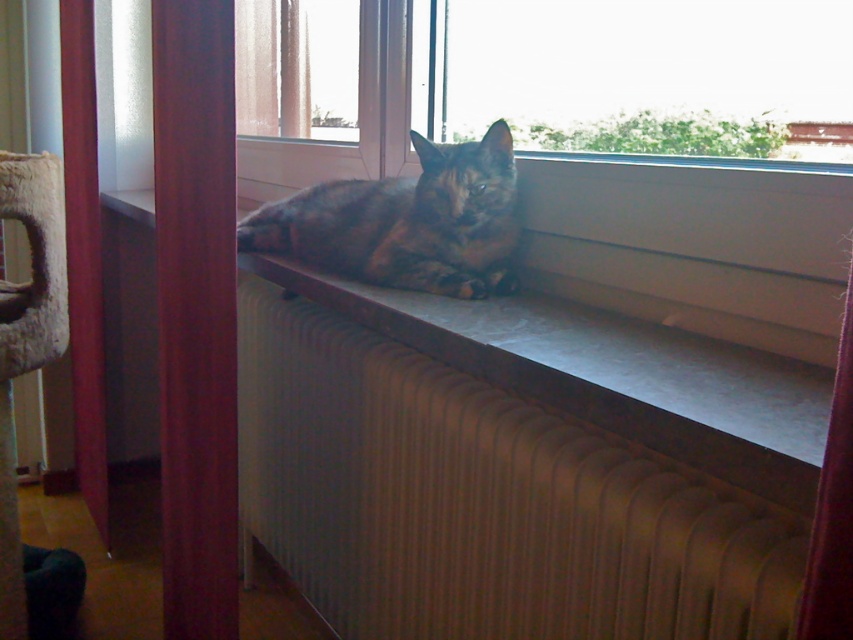
You are a cat owner who wants to place a small cat tree between the metallic radiator at lower center and the velvet red curtain at lower right. The cat tree requires 30 inches of space. Based on the scene, will there be enough space?

The metallic radiator at lower center and velvet red curtain at lower right are 27.92 inches apart, which is less than the required 30 inches. Therefore, there is not enough space to place the cat tree between them.

You are a delivery robot trying to locate the transparent glass window at upper center in the scene. According to the coordinates provided, where exactly is it located?

The transparent glass window at upper center is located at point coordinates (640, 76).